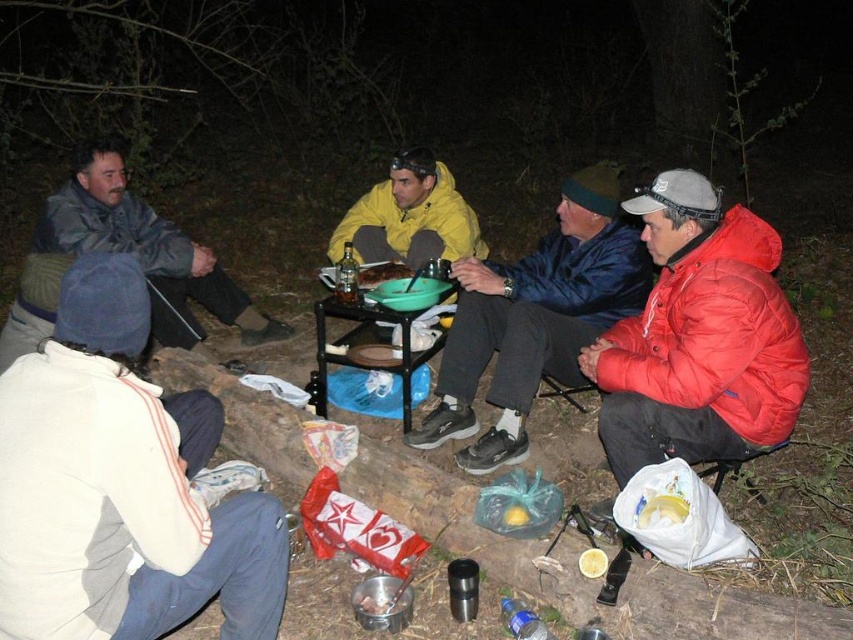
Question: Estimate the real-world distances between objects in this image. Which object is farther from the black metal picnic table at center?

Choices:
 (A) white fleece jacket at lower left
 (B) smooth plastic plate at center

Answer: (A)

Question: Observing the image, what is the correct spatial positioning of yellow waterproof jacket at center in reference to black metal picnic table at center?

Choices:
 (A) left
 (B) right

Answer: (B)

Question: Can you confirm if matte red jacket at right is positioned to the right of smooth plastic plate at center?

Choices:
 (A) no
 (B) yes

Answer: (B)

Question: Estimate the real-world distances between objects in this image. Which object is closer to the gray matte jacket at left?

Choices:
 (A) smooth plastic plate at center
 (B) yellow waterproof jacket at center
 (C) black metal picnic table at center
 (D) matte red jacket at right

Answer: (B)

Question: Among these objects, which one is farthest from the camera?

Choices:
 (A) gray matte jacket at left
 (B) yellow waterproof jacket at center
 (C) matte blue jacket at center
 (D) smooth plastic plate at center

Answer: (B)

Question: Can you confirm if yellow waterproof jacket at center is positioned above black metal picnic table at center?

Choices:
 (A) no
 (B) yes

Answer: (B)